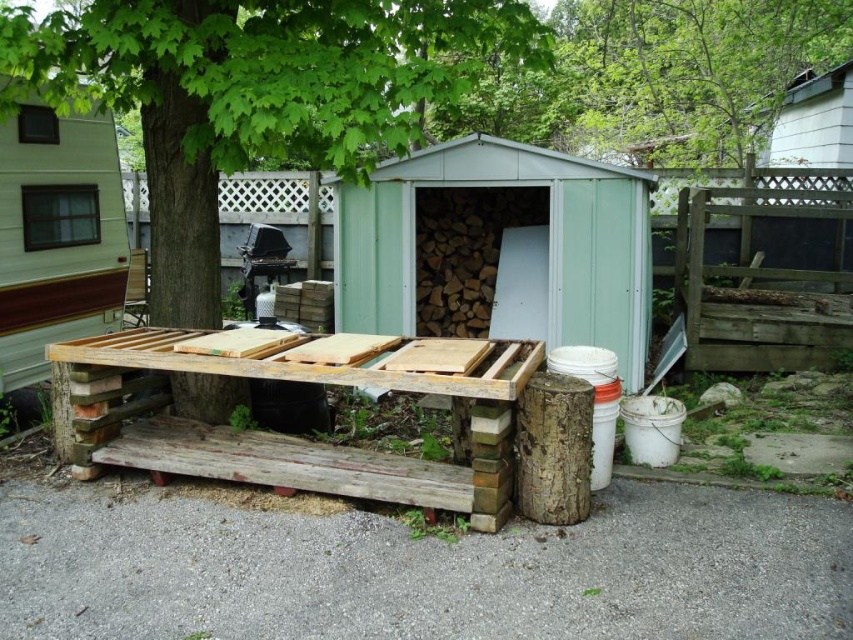
Can you confirm if green leafy tree at upper center is taller than green wood hut at upper left?

Yes, green leafy tree at upper center is taller than green wood hut at upper left.

Who is higher up, green leafy tree at upper center or green wood hut at upper left?

green leafy tree at upper center

At what (x,y) coordinates should I click in order to perform the action: click on green leafy tree at upper center. Please return your answer as a coordinate pair (x, y). Looking at the image, I should click on (689, 68).

Is green leafy tree at center smaller than weathered wood picnic table at lower left?

No.

Who is positioned more to the right, green leafy tree at center or weathered wood picnic table at lower left?

Positioned to the right is green leafy tree at center.

Find the location of a particular element. green leafy tree at center is located at coordinates (253, 93).

Does weathered wood picnic table at lower left have a greater height compared to green leafy tree at upper center?

Incorrect, weathered wood picnic table at lower left's height is not larger of green leafy tree at upper center's.

Who is more distant from viewer, (341, 368) or (712, 129)?

The point (712, 129) is behind.

The height and width of the screenshot is (640, 853). I want to click on weathered wood picnic table at lower left, so click(294, 436).

Where is `weathered wood picnic table at lower left`? weathered wood picnic table at lower left is located at coordinates (294, 436).